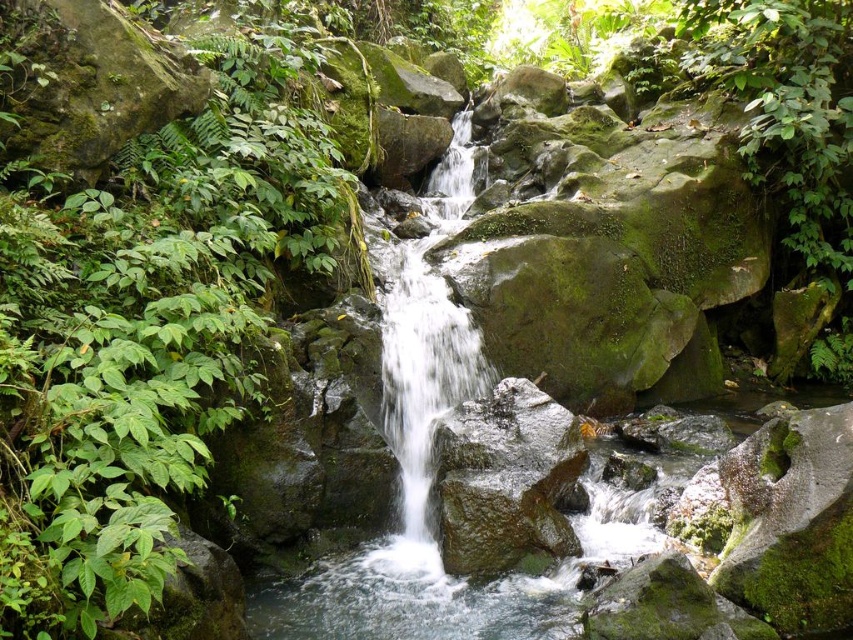
Question: From the image, what is the correct spatial relationship of green leafy plant at left in relation to smooth gray rock at center?

Choices:
 (A) above
 (B) below

Answer: (A)

Question: Which point is farther to the camera?

Choices:
 (A) smooth gray rock at center
 (B) green leafy plant at left

Answer: (A)

Question: Is green leafy plant at left to the right of smooth gray rock at center from the viewer's perspective?

Choices:
 (A) no
 (B) yes

Answer: (A)

Question: Is green leafy plant at left wider than smooth gray rock at center?

Choices:
 (A) yes
 (B) no

Answer: (A)